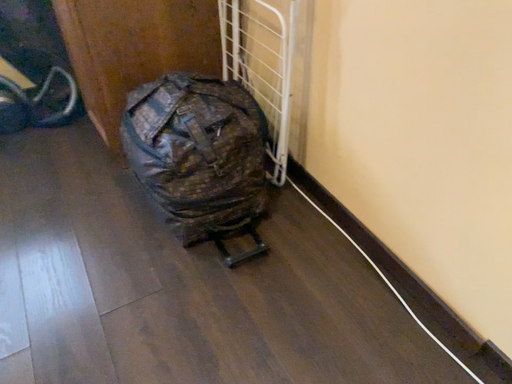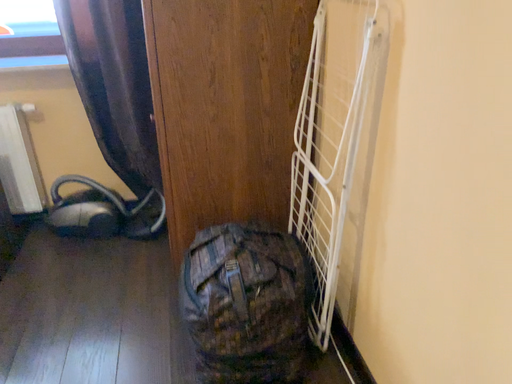
Question: Which way did the camera rotate in the video?

Choices:
 (A) rotated right
 (B) rotated left

Answer: (B)